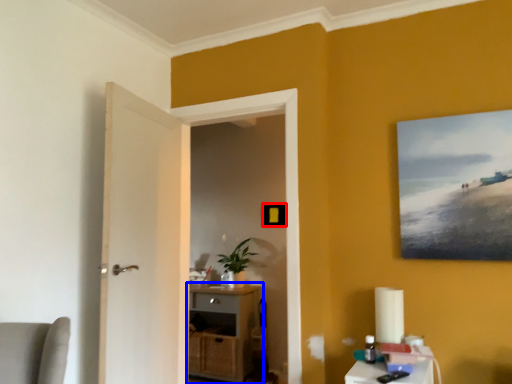
Question: Which object appears farthest to the camera in this image, picture frame (highlighted by a red box) or cabinetry (highlighted by a blue box)?

Choices:
 (A) picture frame
 (B) cabinetry

Answer: (A)